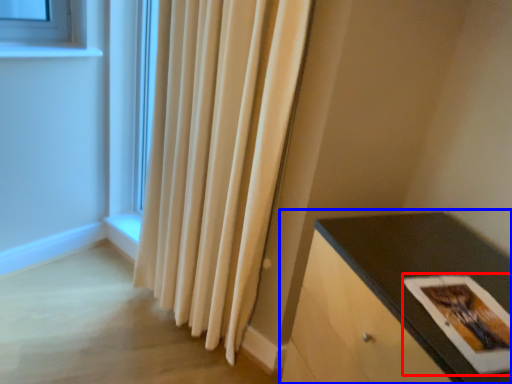
Question: Among these objects, which one is nearest to the camera, postcard (highlighted by a red box) or table (highlighted by a blue box)?

Choices:
 (A) postcard
 (B) table

Answer: (B)